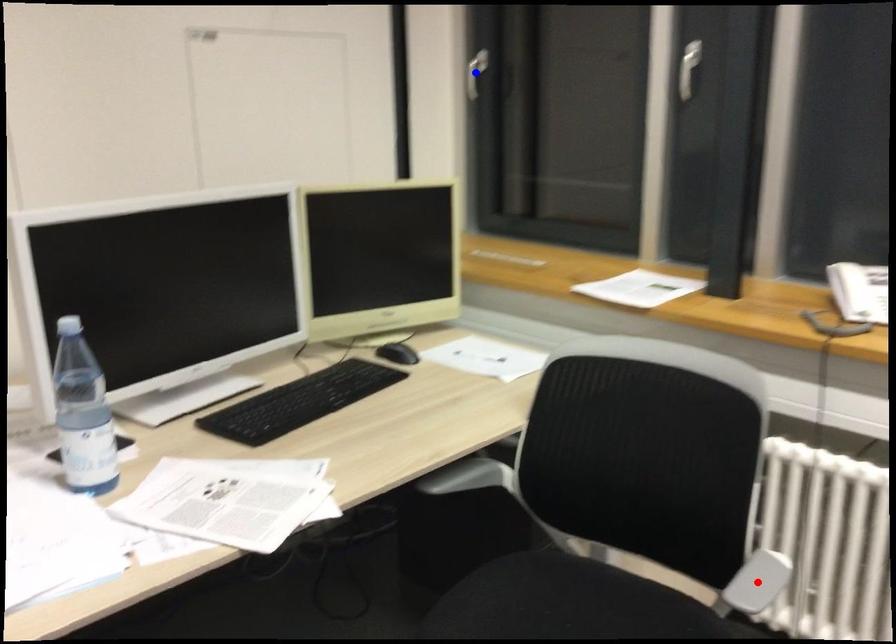
Question: Which of the two points in the image is closer to the camera?

Choices:
 (A) Blue point is closer.
 (B) Red point is closer.

Answer: (B)